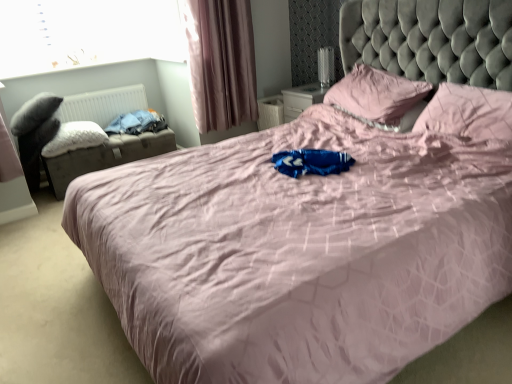
Question: From the image's perspective, does transparent glass window at upper left appear lower than pink fabric pillow at upper right, positioned as the 1th pillow in right-to-left order?

Choices:
 (A) no
 (B) yes

Answer: (A)

Question: Could you tell me if transparent glass window at upper left is facing pink fabric pillow at upper right, the 3th pillow when ordered from left to right?

Choices:
 (A) yes
 (B) no

Answer: (A)

Question: Is transparent glass window at upper left bigger than pink fabric pillow at upper right, the 3th pillow when ordered from left to right?

Choices:
 (A) no
 (B) yes

Answer: (A)

Question: Can pink fabric pillow at upper right, the 3th pillow when ordered from left to right, be found inside transparent glass window at upper left?

Choices:
 (A) no
 (B) yes

Answer: (A)

Question: Does transparent glass window at upper left have a lesser height compared to pink fabric pillow at upper right, the 3th pillow when ordered from left to right?

Choices:
 (A) no
 (B) yes

Answer: (A)

Question: Based on their positions, is leatherette storage ottoman at left located to the left or right of pink fabric curtain at upper left?

Choices:
 (A) right
 (B) left

Answer: (B)

Question: Considering the positions of leatherette storage ottoman at left and pink fabric curtain at upper left in the image, is leatherette storage ottoman at left wider or thinner than pink fabric curtain at upper left?

Choices:
 (A) thin
 (B) wide

Answer: (B)

Question: Is leatherette storage ottoman at left situated inside pink fabric curtain at upper left or outside?

Choices:
 (A) outside
 (B) inside

Answer: (A)

Question: Is leatherette storage ottoman at left taller or shorter than pink fabric curtain at upper left?

Choices:
 (A) short
 (B) tall

Answer: (A)

Question: Based on their positions, is leatherette storage ottoman at left located to the left or right of blue cotton clothes at left?

Choices:
 (A) left
 (B) right

Answer: (A)

Question: Is point (64, 155) positioned closer to the camera than point (139, 130)?

Choices:
 (A) closer
 (B) farther

Answer: (A)

Question: From the image's perspective, is leatherette storage ottoman at left above or below blue cotton clothes at left?

Choices:
 (A) below
 (B) above

Answer: (A)

Question: Is leatherette storage ottoman at left in front of or behind blue cotton clothes at left in the image?

Choices:
 (A) behind
 (B) front

Answer: (B)

Question: Is transparent glass window at upper left to the left or to the right of white fluffy pillow at left, placed as the 3th pillow when sorted from right to left, in the image?

Choices:
 (A) right
 (B) left

Answer: (B)

Question: From the image's perspective, is transparent glass window at upper left positioned above or below white fluffy pillow at left, the 1th pillow viewed from the left?

Choices:
 (A) above
 (B) below

Answer: (A)